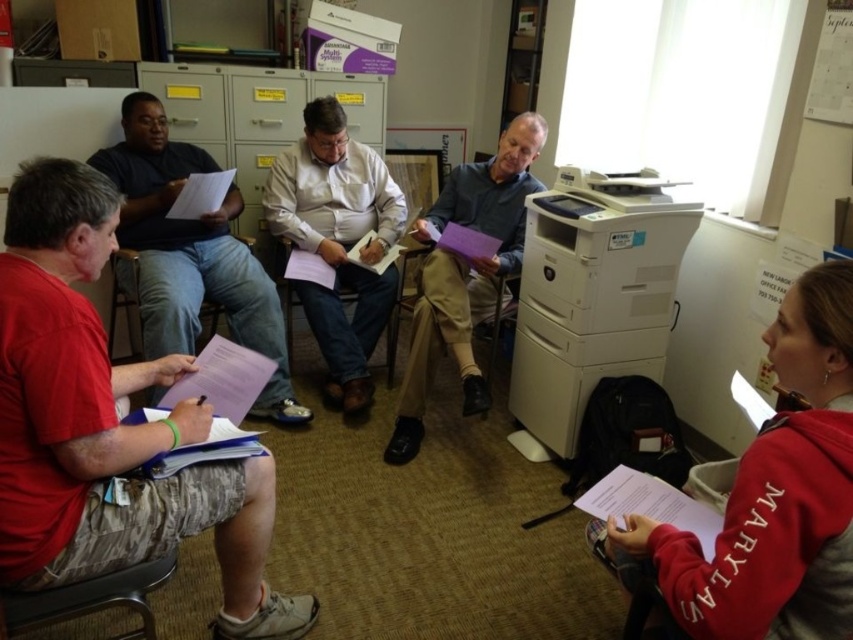
You are organizing documents in an office setting. You see the matte khaki shirt at center and the matte purple folder at center. Which object is located above the other?

The matte khaki shirt at center is positioned over the matte purple folder at center, so it is above the folder.

In the scene shown: You are organizing a meeting in the office and need to place the matte purple folder at center on top of the matte plastic chair at lower left. Is the folder too large to fit on the chair?

The matte purple folder at center is larger in size compared to the matte plastic chair at lower left, so it might not fit properly on top of the chair.

You are organizing documents in an office and need to place the matte purple folder at center onto a surface. Can you put it on the matte plastic chair at lower left?

The matte purple folder at center is positioned over matte plastic chair at lower left, which suggests that it is already placed on the chair. Therefore, it is possible to put it there as it is already on the chair.